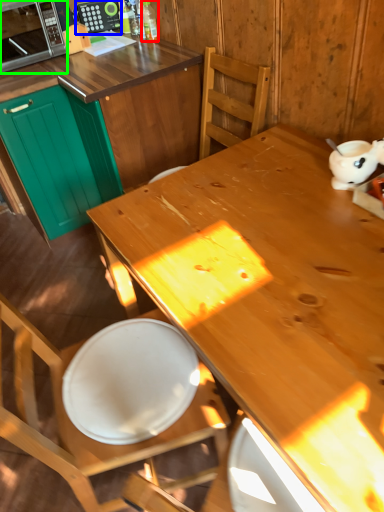
Question: Which object is positioned farthest from bottle (highlighted by a red box)? Select from appliance (highlighted by a blue box) and microwave oven (highlighted by a green box).

Choices:
 (A) appliance
 (B) microwave oven

Answer: (B)